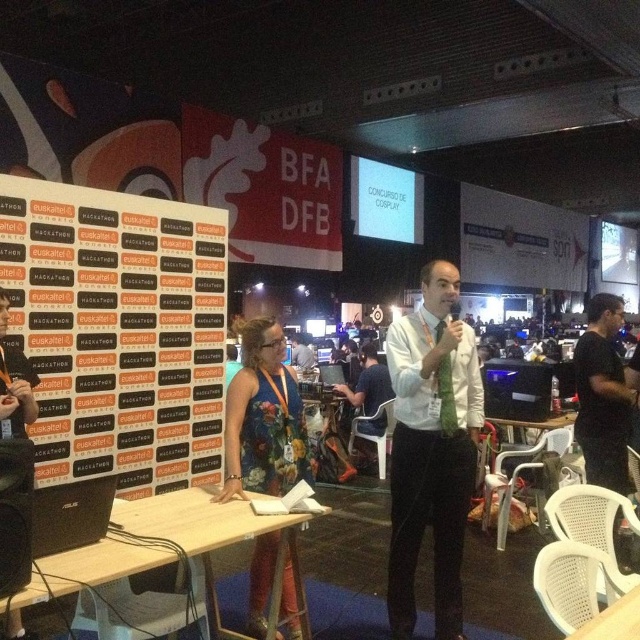
Question: Does white glossy shirt at center have a smaller size compared to floral dress at center?

Choices:
 (A) no
 (B) yes

Answer: (A)

Question: Which object appears farthest from the camera in this image?

Choices:
 (A) white paperboard at left
 (B) white shirt at center

Answer: (B)

Question: Observing the image, what is the correct spatial positioning of floral dress at center in reference to black fabric shirt at right?

Choices:
 (A) right
 (B) left

Answer: (B)

Question: Which point is closer to the camera?

Choices:
 (A) white glossy shirt at center
 (B) floral dress at center
 (C) white shirt at center
 (D) black fabric shirt at right

Answer: (B)

Question: Which of the following is the closest to the observer?

Choices:
 (A) (381, 384)
 (B) (232, 400)
 (C) (193, 381)
 (D) (592, 380)

Answer: (B)

Question: Does white glossy shirt at center come in front of black fabric shirt at right?

Choices:
 (A) yes
 (B) no

Answer: (A)